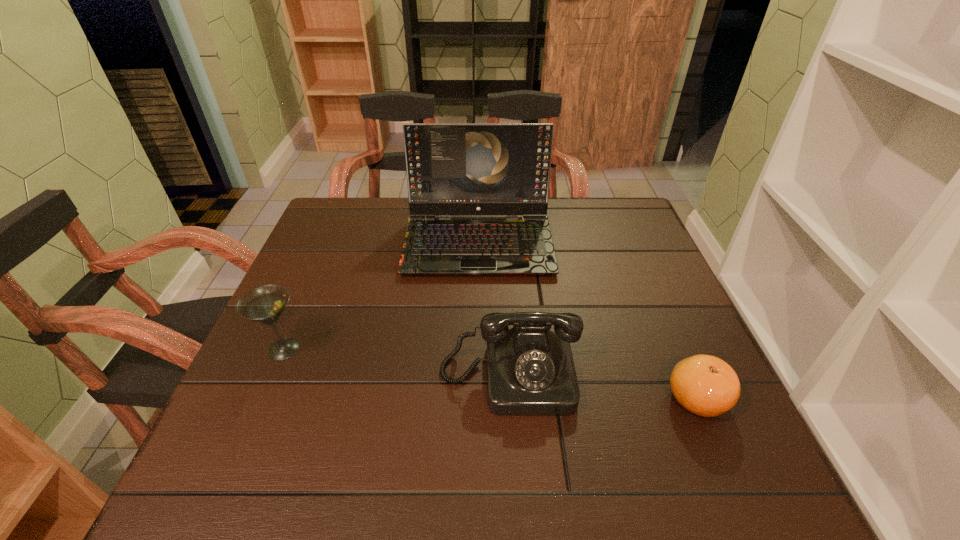
The image size is (960, 540). I want to click on vacant space at the near right corner of the desktop, so click(690, 456).

This screenshot has height=540, width=960. I want to click on free space between the farthest object and the clementine, so click(x=588, y=321).

This screenshot has height=540, width=960. Find the location of `vacant point located between the tallest object and the telephone`. vacant point located between the tallest object and the telephone is located at coordinates (493, 309).

Locate an element on the screen. The width and height of the screenshot is (960, 540). free space between the rightmost object and the farthest object is located at coordinates (588, 321).

This screenshot has height=540, width=960. Identify the location of vacant space in between the telephone and the second tallest object. (396, 363).

Where is `free space between the leftmost object and the tallest object`? free space between the leftmost object and the tallest object is located at coordinates (381, 295).

Identify the location of object that can be found as the closest to the telephone. (705, 385).

Locate which object is the closest to the tallest object. Please provide its 2D coordinates. Your answer should be formatted as a tuple, i.e. [(x, y)], where the tuple contains the x and y coordinates of a point satisfying the conditions above.

[(530, 370)]

Find the location of a particular element. This screenshot has width=960, height=540. free spot that satisfies the following two spatial constraints: 1. on the front side of the martini; 2. on the left side of the shortest object is located at coordinates (263, 399).

Find the location of `free space that satisfies the following two spatial constraints: 1. on the dial of the rightmost object; 2. on the left side of the second shortest object`. free space that satisfies the following two spatial constraints: 1. on the dial of the rightmost object; 2. on the left side of the second shortest object is located at coordinates (511, 399).